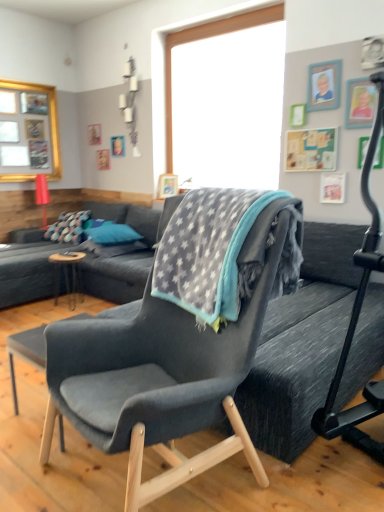
Image resolution: width=384 pixels, height=512 pixels. Describe the element at coordinates (109, 233) in the screenshot. I see `blue fabric pillow at center` at that location.

Locate an element on the screen. gray fleece blanket at center is located at coordinates (209, 252).

Describe the element at coordinates (209, 252) in the screenshot. This screenshot has width=384, height=512. I see `gray fleece blanket at center` at that location.

At what (x,y) coordinates should I click in order to perform the action: click on black rubber baby carriage at right. Please return your answer as a coordinate pair (x, y). The width and height of the screenshot is (384, 512). Looking at the image, I should click on (357, 319).

The image size is (384, 512). Describe the element at coordinates (66, 274) in the screenshot. I see `brown wooden table at center` at that location.

The image size is (384, 512). I want to click on blue fabric pillow at center, so click(x=109, y=233).

Do you think brown wooden table at center is within gold-framed picture at upper left, or outside of it?

brown wooden table at center exists outside the volume of gold-framed picture at upper left.

Between brown wooden table at center and gold-framed picture at upper left, which one appears on the left side from the viewer's perspective?

gold-framed picture at upper left.

Looking at the image, does brown wooden table at center seem bigger or smaller compared to gold-framed picture at upper left?

Clearly, brown wooden table at center is smaller in size than gold-framed picture at upper left.

From a real-world perspective, is brown wooden table at center physically located above or below gold-framed picture at upper left?

Clearly, from a real-world perspective, brown wooden table at center is below gold-framed picture at upper left.

Is point (58, 126) farther from camera compared to point (175, 229)?

Yes, point (58, 126) is behind point (175, 229).

This screenshot has width=384, height=512. Find the location of `blanket below the gold-framed picture at upper left (from the image's perspective)`. blanket below the gold-framed picture at upper left (from the image's perspective) is located at coordinates (209, 252).

From the image's perspective, is gold-framed picture at upper left on gray fleece blanket at center?

Yes.

From the picture: Does gold-framed picture at upper left appear on the left side of gray fleece blanket at center?

Indeed, gold-framed picture at upper left is positioned on the left side of gray fleece blanket at center.

Is velvet dark blue armchair at center far away from dark gray fabric couch at left?

Absolutely, velvet dark blue armchair at center is distant from dark gray fabric couch at left.

From the image's perspective, is velvet dark blue armchair at center under dark gray fabric couch at left?

Correct, velvet dark blue armchair at center appears lower than dark gray fabric couch at left in the image.

In the scene shown: From a real-world perspective, is velvet dark blue armchair at center physically located above or below dark gray fabric couch at left?

From a real-world perspective, velvet dark blue armchair at center is physically above dark gray fabric couch at left.

Is point (256, 265) in front of point (49, 86)?

Yes.

From a real-world perspective, is gray fleece blanket at center above or below gold-framed picture at upper left?

gray fleece blanket at center is below gold-framed picture at upper left.

How many degrees apart are the facing directions of gray fleece blanket at center and gold-framed picture at upper left?

The facing directions of gray fleece blanket at center and gold-framed picture at upper left are 97.2 degrees apart.

Who is more distant, gray fleece blanket at center or dark gray fabric couch at left?

dark gray fabric couch at left.

The image size is (384, 512). I want to click on studio couch above the gray fleece blanket at center (from the image's perspective), so click(x=83, y=262).

Looking at this image, is gray fleece blanket at center thinner than dark gray fabric couch at left?

Indeed, gray fleece blanket at center has a lesser width compared to dark gray fabric couch at left.

From the image's perspective, which one is positioned lower, gray fleece blanket at center or dark gray fabric couch at left?

From the image's view, gray fleece blanket at center is below.

What's the angular difference between blue fabric pillow at center and gray fleece blanket at center's facing directions?

The angle between the facing direction of blue fabric pillow at center and the facing direction of gray fleece blanket at center is 80.3 degrees.

From the picture: Can you confirm if blue fabric pillow at center is positioned to the left of gray fleece blanket at center?

Correct, you'll find blue fabric pillow at center to the left of gray fleece blanket at center.

Can gray fleece blanket at center be found inside blue fabric pillow at center?

No, gray fleece blanket at center is not surrounded by blue fabric pillow at center.

Between blue fabric pillow at center and gray fleece blanket at center, which one has larger size?

gray fleece blanket at center is bigger.

Considering the sizes of objects blue fabric pillow at center and brown wooden table at center in the image provided, who is bigger, blue fabric pillow at center or brown wooden table at center?

blue fabric pillow at center.

In the scene shown: Is blue fabric pillow at center taller than brown wooden table at center?

Incorrect, the height of blue fabric pillow at center is not larger of that of brown wooden table at center.

The image size is (384, 512). I want to click on table below the blue fabric pillow at center (from the image's perspective), so point(66,274).

Can you tell me how much blue fabric pillow at center and brown wooden table at center differ in facing direction?

The angular difference between blue fabric pillow at center and brown wooden table at center is 23.5 degrees.

I want to click on window screen lying behind the brown wooden table at center, so click(x=50, y=120).

Where is `window screen above the gray fleece blanket at center (from the image's perspective)`? The image size is (384, 512). window screen above the gray fleece blanket at center (from the image's perspective) is located at coordinates (50, 120).

Looking at this image, from the image, which object appears to be farther from black rubber baby carriage at right, gray fleece blanket at center or brown wooden table at center?

brown wooden table at center is further to black rubber baby carriage at right.

Looking at the image, which one is located closer to blue fabric pillow at center, brown wooden table at center or black rubber baby carriage at right?

Based on the image, brown wooden table at center appears to be nearer to blue fabric pillow at center.

Considering their positions, is gray fleece blanket at center positioned closer to black rubber baby carriage at right than blue fabric pillow at center?

Among the two, gray fleece blanket at center is located nearer to black rubber baby carriage at right.

Looking at the image, which one is located closer to dark gray fabric couch at left, gray fleece blanket at center or gold-framed picture at upper left?

gold-framed picture at upper left lies closer to dark gray fabric couch at left than the other object.

Based on their spatial positions, is gold-framed picture at upper left or velvet dark blue armchair at center closer to brown wooden table at center?

The object closer to brown wooden table at center is gold-framed picture at upper left.

When comparing their distances from black rubber baby carriage at right, does gold-framed picture at upper left or brown wooden table at center seem closer?

Among the two, brown wooden table at center is located nearer to black rubber baby carriage at right.

Estimate the real-world distances between objects in this image. Which object is further from velvet dark blue armchair at center, blue fabric pillow at center or gold-framed picture at upper left?

Among the two, gold-framed picture at upper left is located further to velvet dark blue armchair at center.

Which object lies further to the anchor point brown wooden table at center, dark gray fabric couch at left or gold-framed picture at upper left?

The object further to brown wooden table at center is gold-framed picture at upper left.

Find the location of a particular element. pillow that lies between gold-framed picture at upper left and brown wooden table at center from top to bottom is located at coordinates (109, 233).

Image resolution: width=384 pixels, height=512 pixels. What are the coordinates of `baby carriage between velvet dark blue armchair at center and brown wooden table at center from front to back` in the screenshot? It's located at (357, 319).

This screenshot has width=384, height=512. I want to click on table located between black rubber baby carriage at right and blue fabric pillow at center in the depth direction, so click(x=66, y=274).

This screenshot has height=512, width=384. What are the coordinates of `pillow positioned between black rubber baby carriage at right and gold-framed picture at upper left from near to far` in the screenshot? It's located at (109, 233).